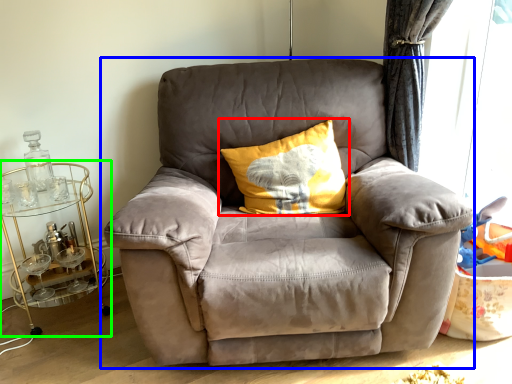
Question: Estimate the real-world distances between objects in this image. Which object is farther from pillow (highlighted by a red box), chair (highlighted by a blue box) or table (highlighted by a green box)?

Choices:
 (A) chair
 (B) table

Answer: (B)